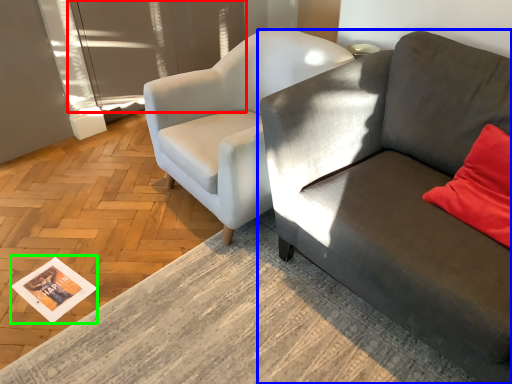
Question: Based on their relative distances, which object is nearer to glass door (highlighted by a red box)? Choose from studio couch (highlighted by a blue box) and magazine (highlighted by a green box).

Choices:
 (A) studio couch
 (B) magazine

Answer: (B)